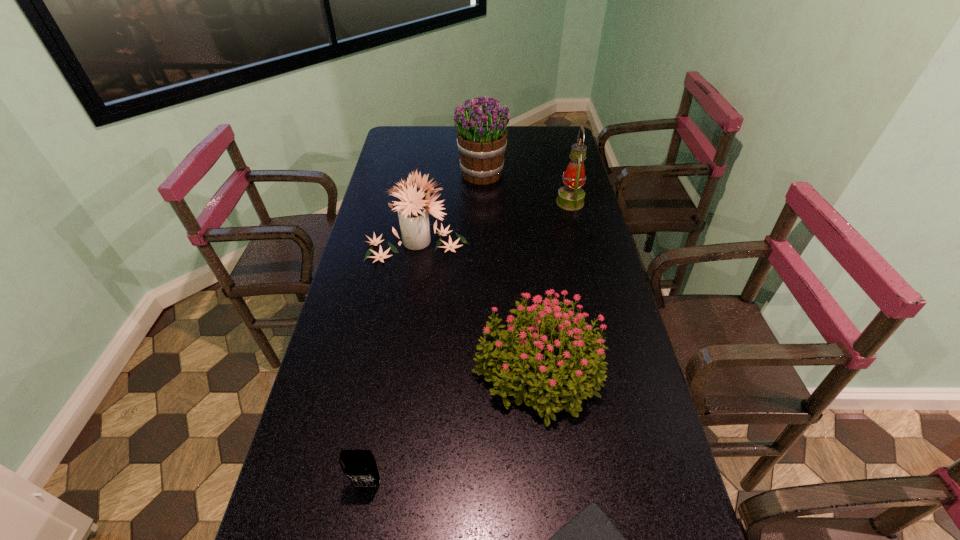
What are the coordinates of `vacant space that is in between the nearest bouquet and the second nearest bouquet` in the screenshot? It's located at (477, 306).

Find the location of a particular element. Image resolution: width=960 pixels, height=540 pixels. unoccupied area between the farthest bouquet and the second nearest object is located at coordinates [424, 329].

Find the location of a particular element. Image resolution: width=960 pixels, height=540 pixels. free space between the fifth tallest object and the fourth nearest object is located at coordinates (392, 364).

You are a GUI agent. You are given a task and a screenshot of the screen. Output one action in this format:
    pyautogui.click(x=<x>, y=<y>)
    Task: Click on the vacant space that's between the tallest bouquet and the second nearest bouquet
    This screenshot has width=960, height=540.
    Given the screenshot: What is the action you would take?
    pyautogui.click(x=449, y=208)

Where is `vacant area between the fourth farthest object and the second shortest object`? vacant area between the fourth farthest object and the second shortest object is located at coordinates (452, 426).

Choose which object is the fourth nearest neighbor to the tallest bouquet. Please provide its 2D coordinates. Your answer should be formatted as a tuple, i.e. [(x, y)], where the tuple contains the x and y coordinates of a point satisfying the conditions above.

[(359, 466)]

Select which object appears as the fifth closest to the fourth nearest object. Please provide its 2D coordinates. Your answer should be formatted as a tuple, i.e. [(x, y)], where the tuple contains the x and y coordinates of a point satisfying the conditions above.

[(590, 539)]

Select which bouquet appears as the closest to the Bible. Please provide its 2D coordinates. Your answer should be formatted as a tuple, i.e. [(x, y)], where the tuple contains the x and y coordinates of a point satisfying the conditions above.

[(579, 365)]

Identify which bouquet is located as the nearest to the second nearest object. Please provide its 2D coordinates. Your answer should be formatted as a tuple, i.e. [(x, y)], where the tuple contains the x and y coordinates of a point satisfying the conditions above.

[(579, 365)]

You are a GUI agent. You are given a task and a screenshot of the screen. Output one action in this format:
    pyautogui.click(x=<x>, y=<y>)
    Task: Click on the vacant point that satisfies the following two spatial constraints: 1. on the back side of the third farthest object; 2. on the right side of the farthest bouquet
    The width and height of the screenshot is (960, 540).
    Given the screenshot: What is the action you would take?
    427,174